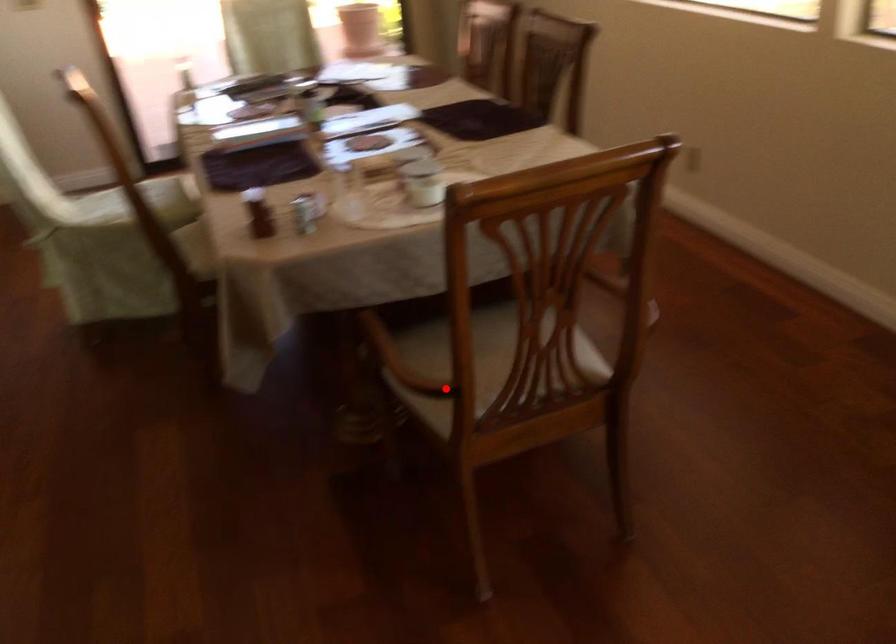
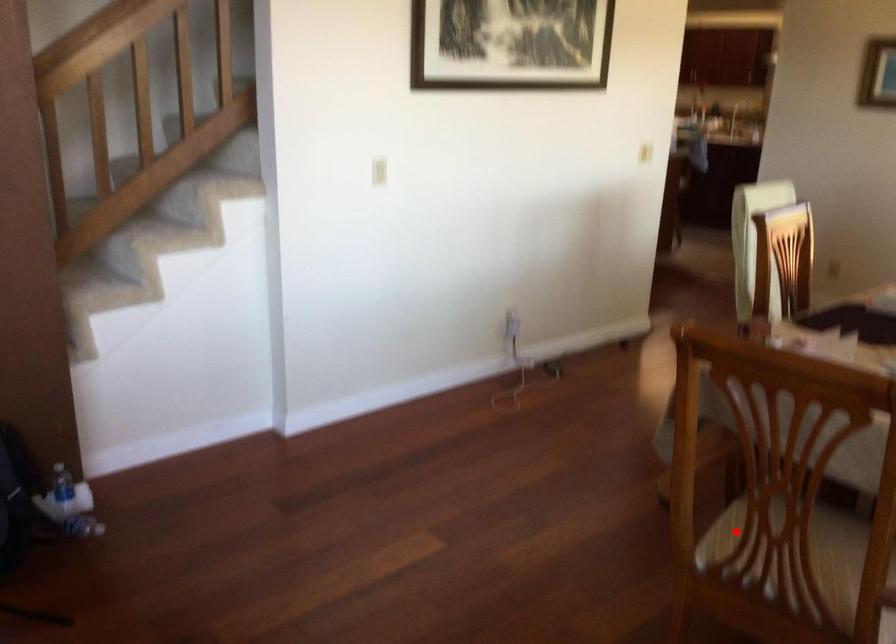
I am providing you with two images of the same scene from different viewpoints. A red point is marked on the first image and another point is marked on the second image. Are the points marked in image1 and image2 representing the same 3D position?

Yes